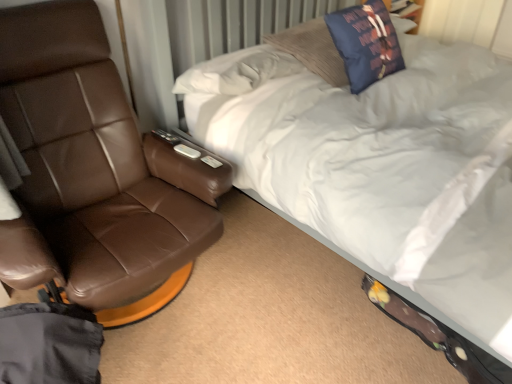
Question: Can you confirm if brown leather chair at left is smaller than white soft bed at upper right?

Choices:
 (A) yes
 (B) no

Answer: (A)

Question: Is brown leather chair at left oriented towards white soft bed at upper right?

Choices:
 (A) no
 (B) yes

Answer: (A)

Question: Is brown leather chair at left bigger than white soft bed at upper right?

Choices:
 (A) yes
 (B) no

Answer: (B)

Question: Considering the relative sizes of brown leather chair at left and white soft bed at upper right in the image provided, is brown leather chair at left taller than white soft bed at upper right?

Choices:
 (A) yes
 (B) no

Answer: (B)

Question: Is the depth of brown leather chair at left less than that of white soft bed at upper right?

Choices:
 (A) yes
 (B) no

Answer: (B)

Question: Is navy blue fabric pillow at upper center taller or shorter than white soft bed at upper right?

Choices:
 (A) tall
 (B) short

Answer: (B)

Question: Which is correct: navy blue fabric pillow at upper center is inside white soft bed at upper right, or outside of it?

Choices:
 (A) outside
 (B) inside

Answer: (B)

Question: Based on their sizes in the image, would you say navy blue fabric pillow at upper center is bigger or smaller than white soft bed at upper right?

Choices:
 (A) small
 (B) big

Answer: (A)

Question: From a real-world perspective, is navy blue fabric pillow at upper center physically located above or below white soft bed at upper right?

Choices:
 (A) below
 (B) above

Answer: (B)

Question: In terms of size, does white soft bed at upper right appear bigger or smaller than brown leather chair at left?

Choices:
 (A) big
 (B) small

Answer: (A)

Question: Relative to brown leather chair at left, is white soft bed at upper right in front or behind?

Choices:
 (A) front
 (B) behind

Answer: (A)

Question: From the image's perspective, is white soft bed at upper right located above or below brown leather chair at left?

Choices:
 (A) above
 (B) below

Answer: (A)

Question: Is white soft bed at upper right wider or thinner than brown leather chair at left?

Choices:
 (A) wide
 (B) thin

Answer: (A)

Question: Considering the positions of brown leather chair at left and navy blue fabric pillow at upper center in the image, is brown leather chair at left wider or thinner than navy blue fabric pillow at upper center?

Choices:
 (A) wide
 (B) thin

Answer: (A)

Question: Is brown leather chair at left situated inside navy blue fabric pillow at upper center or outside?

Choices:
 (A) inside
 (B) outside

Answer: (B)